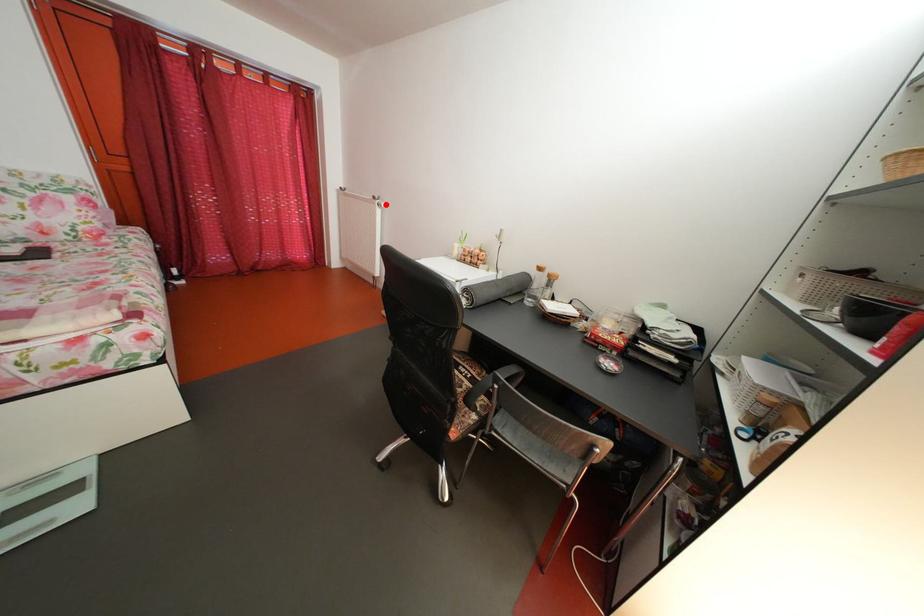
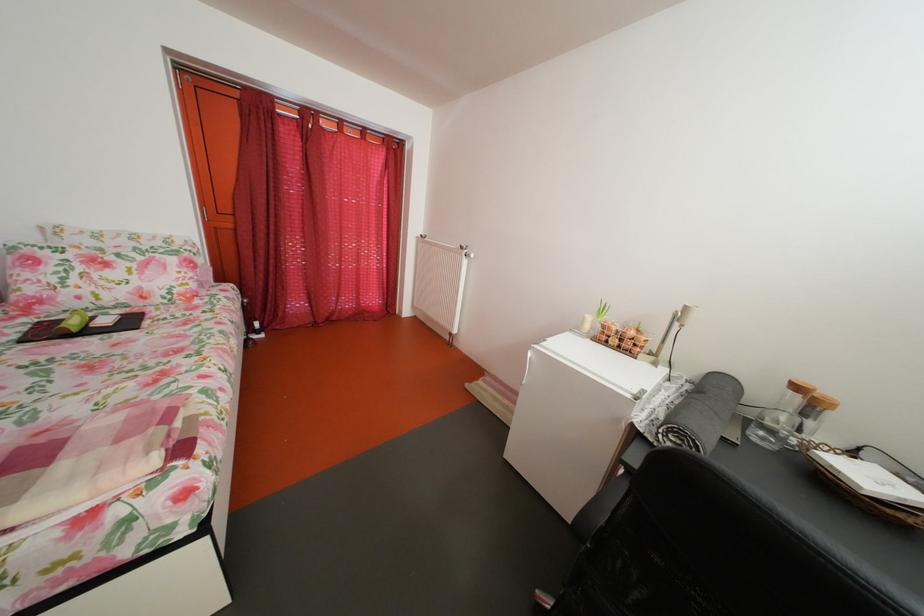
Question: I am providing you with two images of the same scene from different viewpoints. A red point is marked on the first image. At the location where the point appears in image 1, is it still visible in image 2?

Choices:
 (A) Yes
 (B) No

Answer: (A)